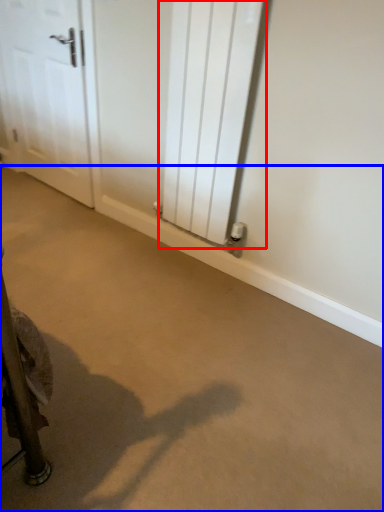
Question: Among these objects, which one is farthest to the camera, radiator (highlighted by a red box) or concrete (highlighted by a blue box)?

Choices:
 (A) radiator
 (B) concrete

Answer: (A)